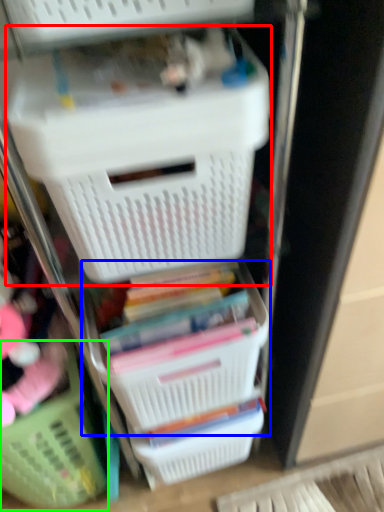
Question: Based on their relative distances, which object is farther from storage box (highlighted by a red box)? Choose from basket (highlighted by a blue box) and basket (highlighted by a green box).

Choices:
 (A) basket
 (B) basket

Answer: (B)